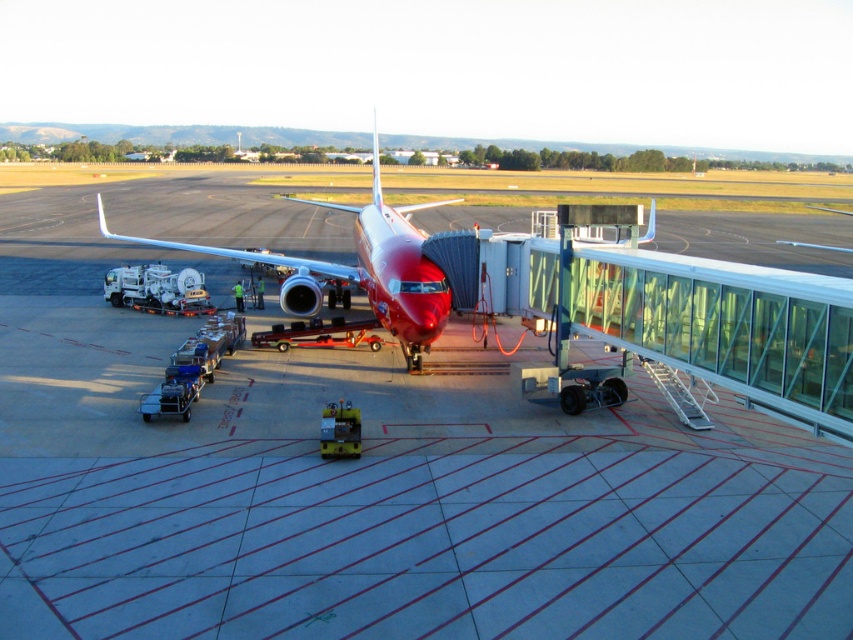
You are a maintenance worker needing to access the underside of the glossy red airplane at center. The smooth concrete tarmac at center is where you are standing. Can you easily see the underside of the airplane from your current position?

The smooth concrete tarmac at center is not as tall as glossy red airplane at center, so you can easily see the underside of the glossy red airplane at center from your current position on the smooth concrete tarmac at center.

You are a ground crew member standing at point (x=413, y=305) and need to walk to point (x=312, y=625). Based on the airport layout, will you have to walk around the red aircraft parked at the gate?

Point (x=312, y=625) is in front of point (x=413, y=305), so you will not have to walk around the red aircraft parked at the gate. You can walk directly to the destination point.